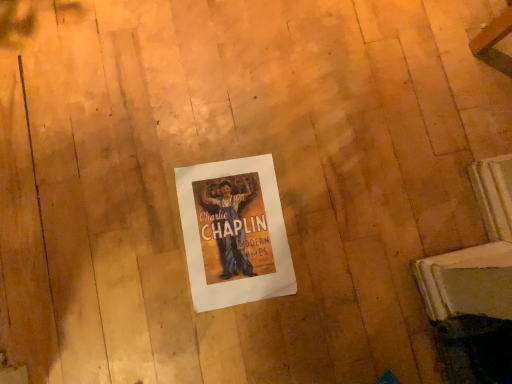
I want to click on vacant area on top of white paper poster at center (from a real-world perspective), so click(x=239, y=231).